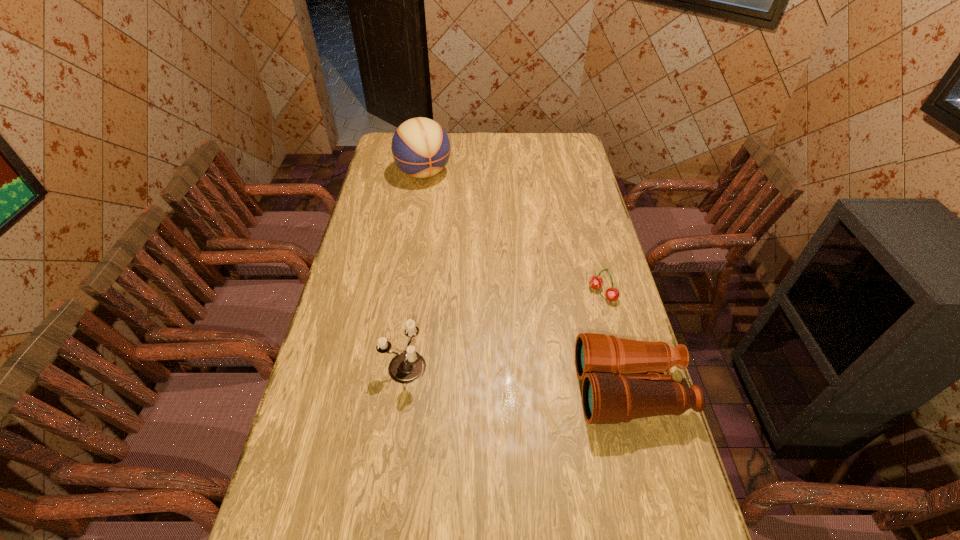
Locate an element on the screen. Image resolution: width=960 pixels, height=540 pixels. free space located on the patterned surface of the tallest object is located at coordinates (446, 212).

Locate an element on the screen. The height and width of the screenshot is (540, 960). free location located 0.360m on the patterned surface of the tallest object is located at coordinates (465, 241).

Locate an element on the screen. The height and width of the screenshot is (540, 960). free region located on the patterned surface of the tallest object is located at coordinates (445, 210).

This screenshot has height=540, width=960. What are the coordinates of `vacant region located with stems pointing upwards on the shortest object` in the screenshot? It's located at [535, 341].

This screenshot has height=540, width=960. I want to click on free space located with stems pointing upwards on the shortest object, so click(x=564, y=321).

The image size is (960, 540). Identify the location of vacant space located 0.170m with stems pointing upwards on the shortest object. (557, 326).

You are a GUI agent. You are given a task and a screenshot of the screen. Output one action in this format:
    pyautogui.click(x=<x>, y=<y>)
    Task: Click on the object positioned at the left edge
    The image size is (960, 540).
    Given the screenshot: What is the action you would take?
    pyautogui.click(x=421, y=148)

In order to click on binoculars situated at the right edge in this screenshot , I will do `click(612, 392)`.

Locate an element on the screen. Image resolution: width=960 pixels, height=540 pixels. cherry at the right edge is located at coordinates (612, 294).

Image resolution: width=960 pixels, height=540 pixels. Find the location of `free point at the far edge`. free point at the far edge is located at coordinates (448, 136).